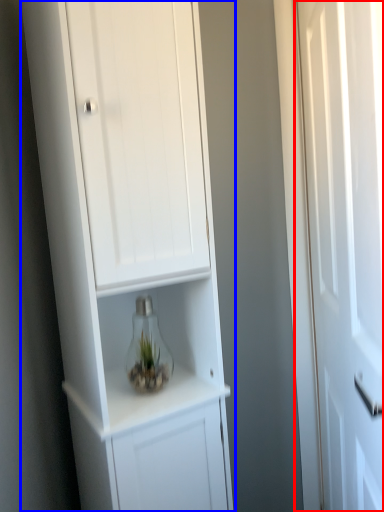
Question: Which of the following is the farthest to the observer, door (highlighted by a red box) or cupboard (highlighted by a blue box)?

Choices:
 (A) door
 (B) cupboard

Answer: (B)